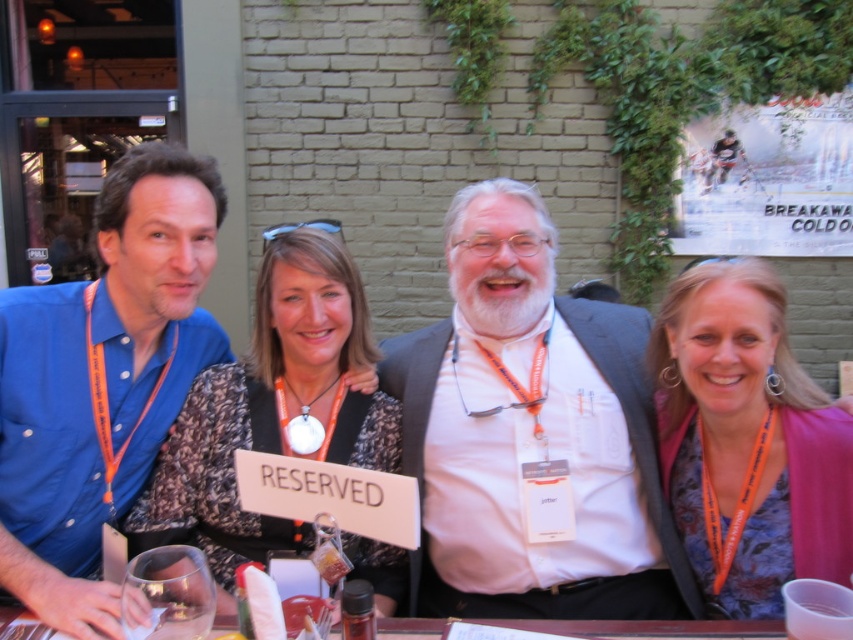
Question: Can you confirm if pink floral blouse at center is thinner than speckled fabric dress at center?

Choices:
 (A) yes
 (B) no

Answer: (A)

Question: Which point is farther to the camera?

Choices:
 (A) click(x=724, y=621)
 (B) click(x=473, y=616)

Answer: (B)

Question: Is white matte suit at center to the left of pink floral blouse at center from the viewer's perspective?

Choices:
 (A) yes
 (B) no

Answer: (A)

Question: Estimate the real-world distances between objects in this image. Which object is farther from the speckled fabric dress at center?

Choices:
 (A) clear glass table at center
 (B) white matte suit at center
 (C) blue cotton shirt at left
 (D) pink floral blouse at center

Answer: (D)

Question: Which object appears closest to the camera in this image?

Choices:
 (A) speckled fabric dress at center
 (B) blue cotton shirt at left
 (C) white matte suit at center

Answer: (B)

Question: From the image, what is the correct spatial relationship of white matte suit at center in relation to pink floral blouse at center?

Choices:
 (A) below
 (B) above

Answer: (B)